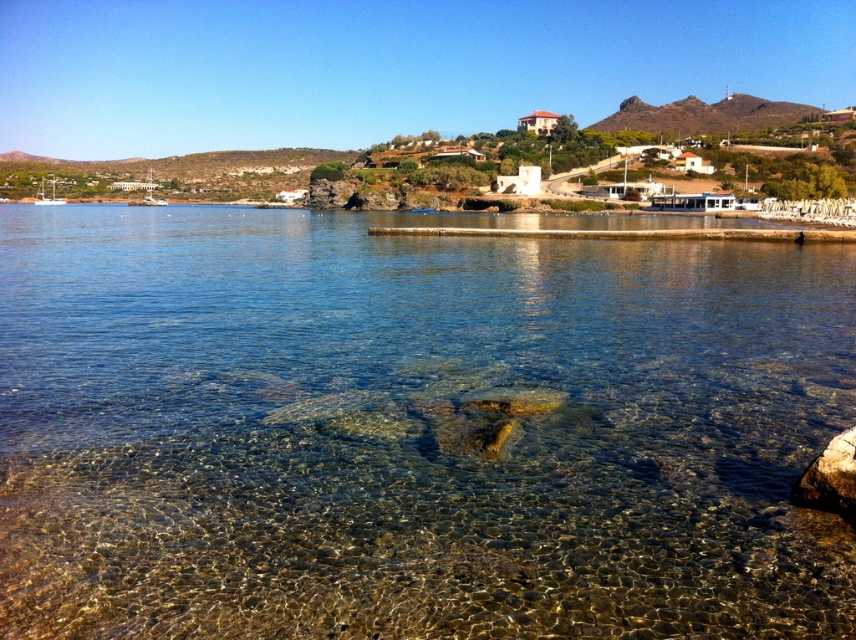
Question: Which of these objects is positioned closest to the brown rocky hill at upper right?

Choices:
 (A) clear water at center
 (B) brown rough rock at lower right

Answer: (A)

Question: Can you confirm if clear water at center is smaller than brown rough rock at lower right?

Choices:
 (A) no
 (B) yes

Answer: (A)

Question: Among these points, which one is nearest to the camera?

Choices:
 (A) (849, 419)
 (B) (837, 484)

Answer: (B)

Question: Is brown rocky hill at upper right closer to camera compared to brown rough rock at lower right?

Choices:
 (A) yes
 (B) no

Answer: (B)

Question: Is brown rocky hill at upper right thinner than brown rough rock at lower right?

Choices:
 (A) yes
 (B) no

Answer: (B)

Question: Considering the real-world distances, which object is closest to the brown rough rock at lower right?

Choices:
 (A) clear water at center
 (B) brown rocky hill at upper right

Answer: (A)